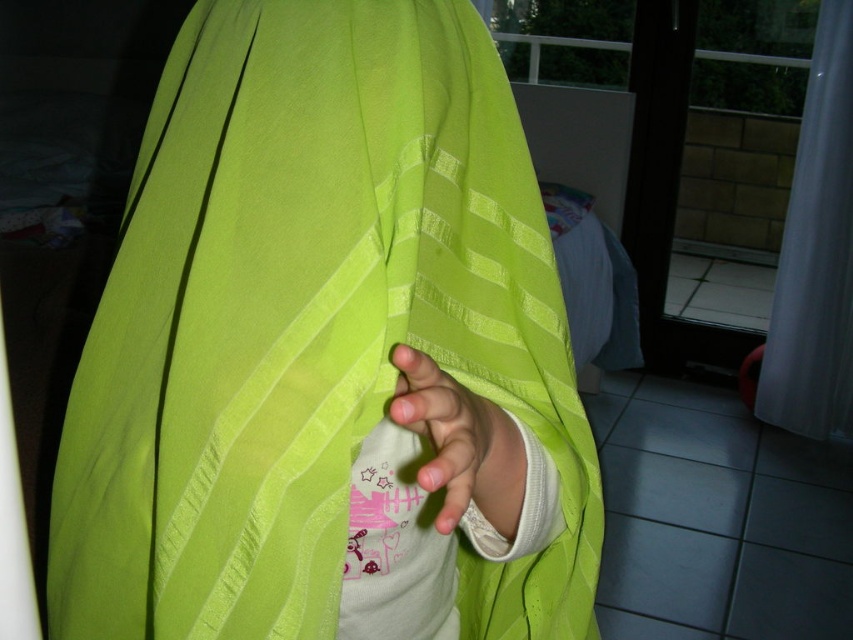
Can you confirm if white sheer curtain at right is bigger than matte green fabric at lower center?

Correct, white sheer curtain at right is larger in size than matte green fabric at lower center.

Does white sheer curtain at right appear under matte green fabric at lower center?

No.

Between point (801, 340) and point (494, 451), which one is positioned behind?

The point (801, 340) is more distant.

The width and height of the screenshot is (853, 640). Find the location of `white sheer curtain at right`. white sheer curtain at right is located at coordinates (816, 252).

Locate an element on the screen. The height and width of the screenshot is (640, 853). lime green fabric at center is located at coordinates (328, 352).

Based on the photo, is lime green fabric at center above matte green fabric at lower center?

Actually, lime green fabric at center is below matte green fabric at lower center.

What do you see at coordinates (328, 352) in the screenshot? I see `lime green fabric at center` at bounding box center [328, 352].

Where is `lime green fabric at center`? lime green fabric at center is located at coordinates (328, 352).

What do you see at coordinates (328, 352) in the screenshot?
I see `lime green fabric at center` at bounding box center [328, 352].

Can you confirm if lime green fabric at center is positioned to the right of white sheer curtain at right?

No, lime green fabric at center is not to the right of white sheer curtain at right.

Who is more forward, (549,588) or (828,228)?

Positioned in front is point (549,588).

In order to click on lime green fabric at center in this screenshot , I will do `click(328, 352)`.